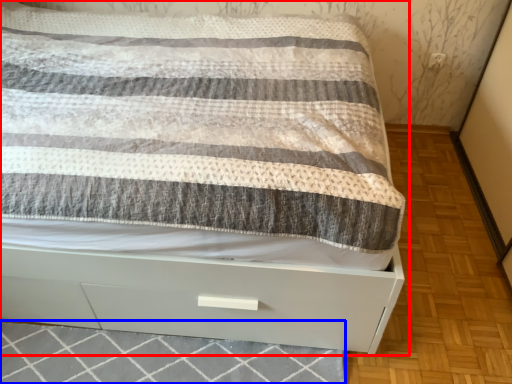
Question: Which object is further to the camera taking this photo, bed (highlighted by a red box) or tile (highlighted by a blue box)?

Choices:
 (A) bed
 (B) tile

Answer: (B)